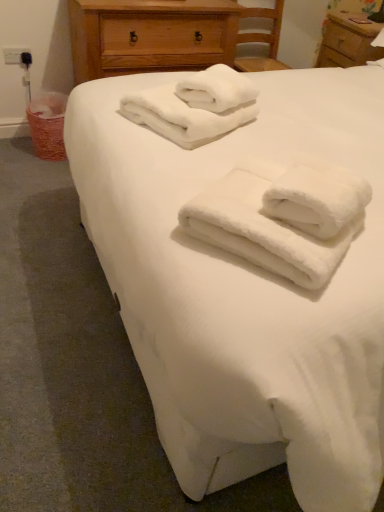
Question: From a real-world perspective, is black plastic outlet at upper left below wooden chest of drawers at upper center?

Choices:
 (A) no
 (B) yes

Answer: (B)

Question: Is wooden chest of drawers at upper center completely or partially inside black plastic outlet at upper left?

Choices:
 (A) no
 (B) yes

Answer: (A)

Question: Can you confirm if black plastic outlet at upper left is smaller than wooden chest of drawers at upper center?

Choices:
 (A) yes
 (B) no

Answer: (A)

Question: Is the depth of black plastic outlet at upper left less than that of wooden chest of drawers at upper center?

Choices:
 (A) yes
 (B) no

Answer: (B)

Question: Is black plastic outlet at upper left turned away from wooden chest of drawers at upper center?

Choices:
 (A) no
 (B) yes

Answer: (A)

Question: Is point (23, 50) positioned closer to the camera than point (238, 144)?

Choices:
 (A) closer
 (B) farther

Answer: (B)

Question: Is black plastic outlet at upper left inside the boundaries of white soft bed at center, or outside?

Choices:
 (A) outside
 (B) inside

Answer: (A)

Question: Considering their positions, is black plastic outlet at upper left located in front of or behind white soft bed at center?

Choices:
 (A) behind
 (B) front

Answer: (A)

Question: In the image, is black plastic outlet at upper left on the left side or the right side of white soft bed at center?

Choices:
 (A) left
 (B) right

Answer: (A)

Question: Is black plastic outlet at upper left situated inside wooden chest of drawers at upper center or outside?

Choices:
 (A) inside
 (B) outside

Answer: (B)

Question: From the image's perspective, is black plastic outlet at upper left located above or below wooden chest of drawers at upper center?

Choices:
 (A) above
 (B) below

Answer: (B)

Question: From a real-world perspective, is black plastic outlet at upper left physically located above or below wooden chest of drawers at upper center?

Choices:
 (A) above
 (B) below

Answer: (B)

Question: Considering the positions of black plastic outlet at upper left and wooden chest of drawers at upper center in the image, is black plastic outlet at upper left taller or shorter than wooden chest of drawers at upper center?

Choices:
 (A) short
 (B) tall

Answer: (A)

Question: From the image's perspective, relative to white fluffy towels at center, which ranks as the second towel in back-to-front order, is wooden chest of drawers at upper center above or below?

Choices:
 (A) above
 (B) below

Answer: (A)

Question: Considering their positions, is wooden chest of drawers at upper center located in front of or behind white fluffy towels at center, which ranks as the second towel in top-to-bottom order?

Choices:
 (A) front
 (B) behind

Answer: (B)